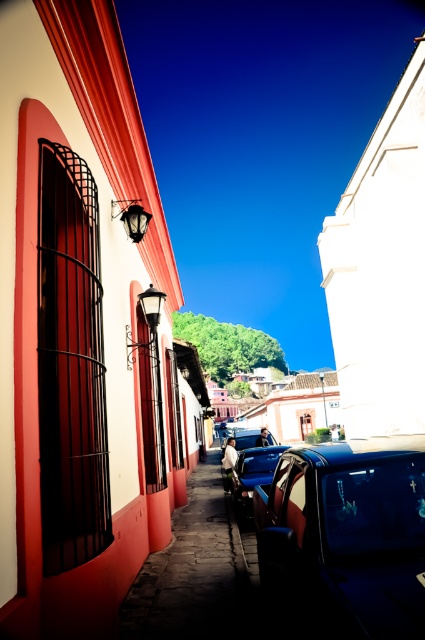
Does glossy blue car at center have a lesser height compared to metallic blue car at center?

Indeed, glossy blue car at center has a lesser height compared to metallic blue car at center.

Between glossy blue car at center and metallic blue car at center, which one appears on the right side from the viewer's perspective?

From the viewer's perspective, metallic blue car at center appears more on the right side.

Which is in front, point (232, 486) or point (255, 438)?

Point (232, 486) is in front.

Where is `glossy blue car at center`? glossy blue car at center is located at coordinates (252, 472).

Between shiny blue car at right and shiny blue car at center, which one has less height?

shiny blue car at right

Consider the image. Who is more forward, [311,588] or [241,577]?

Positioned in front is point [311,588].

Identify the location of shiny blue car at right. (345, 538).

Measure the distance between shiny blue car at right and camera.

shiny blue car at right and camera are 1.68 meters apart.

Does shiny blue car at right appear on the left side of metallic blue car at center?

Indeed, shiny blue car at right is positioned on the left side of metallic blue car at center.

Is point (331, 602) positioned before point (240, 444)?

Yes, point (331, 602) is in front of point (240, 444).

Locate an element on the screen. shiny blue car at right is located at coordinates (345, 538).